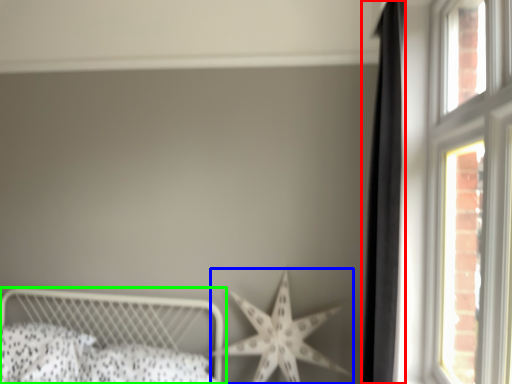
Question: Estimate the real-world distances between objects in this image. Which object is farther from curtain (highlighted by a red box), starfish (highlighted by a blue box) or bed (highlighted by a green box)?

Choices:
 (A) starfish
 (B) bed

Answer: (B)